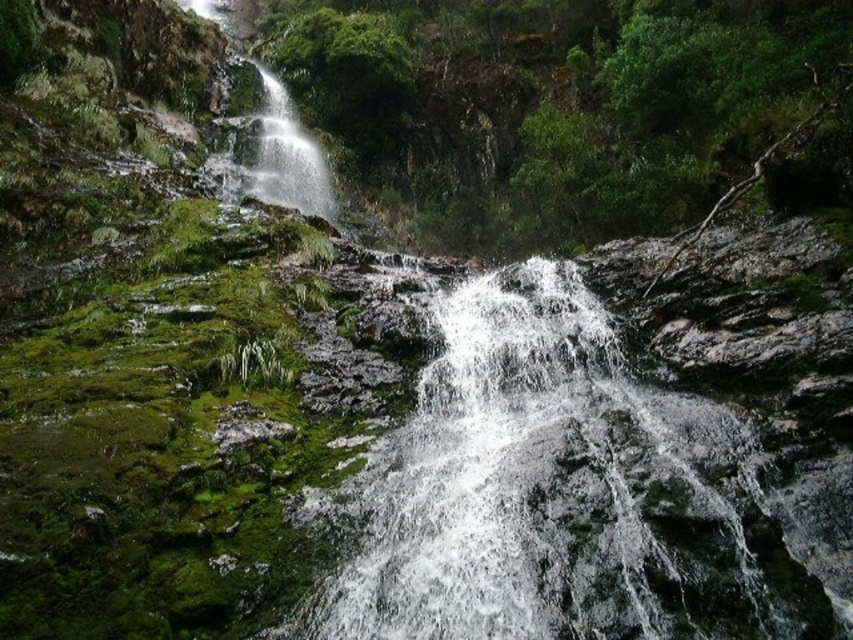
Can you confirm if green mossy rock at upper center is thinner than clear water at center?

No, green mossy rock at upper center is not thinner than clear water at center.

Is green mossy rock at upper center to the left of clear water at center from the viewer's perspective?

Correct, you'll find green mossy rock at upper center to the left of clear water at center.

Measure the distance between point [585,228] and camera.

Point [585,228] and camera are 16.86 meters apart from each other.

Find the location of a particular element. Image resolution: width=853 pixels, height=640 pixels. green mossy rock at upper center is located at coordinates (569, 109).